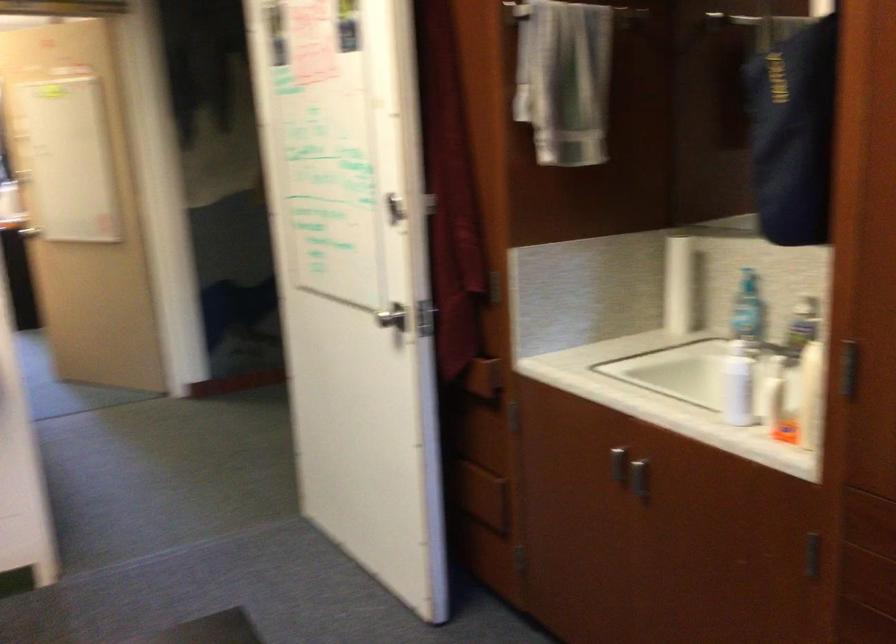
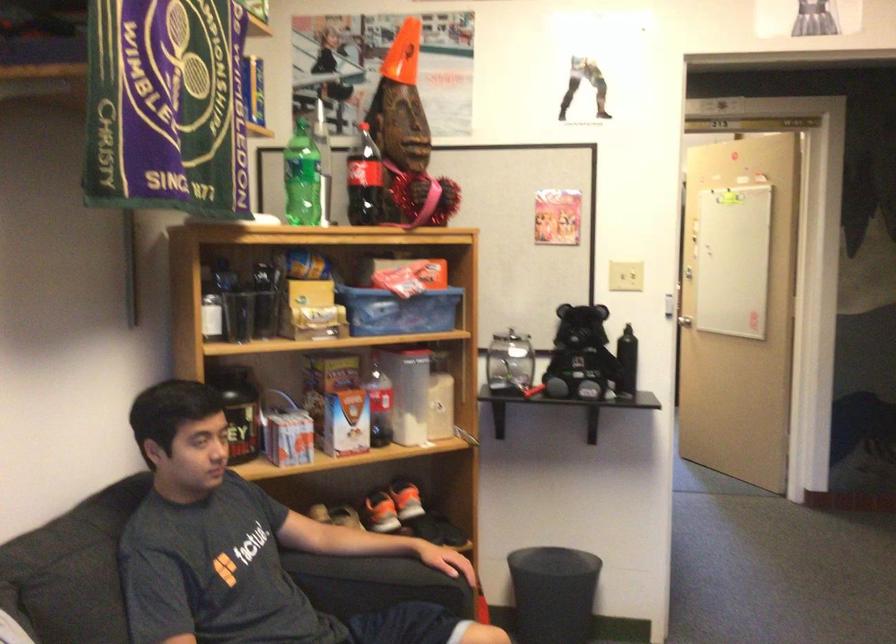
Question: Based on the continuous images, in which direction is the camera rotating? Reply with the corresponding letter.

Choices:
 (A) Left
 (B) Right
 (C) Up
 (D) Down

Answer: (A)